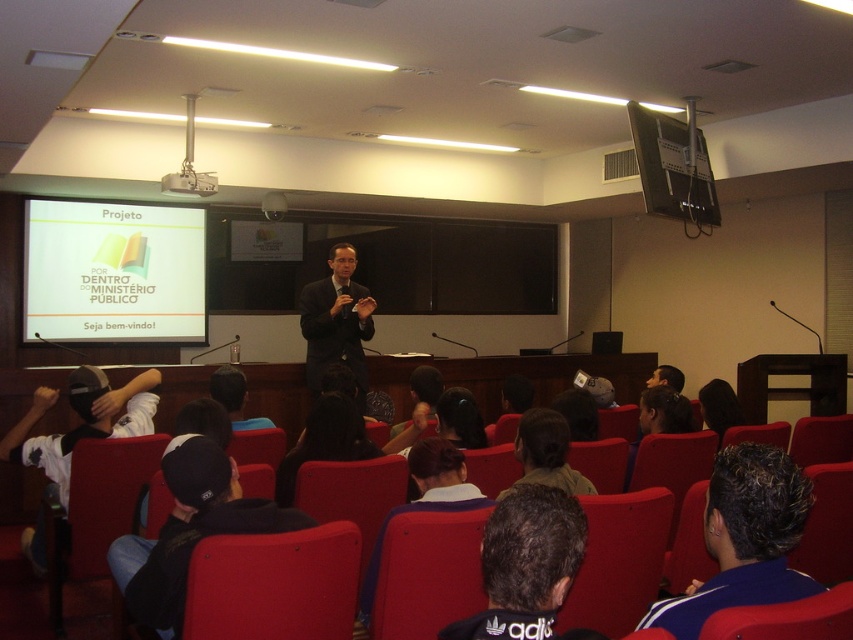
Question: Which point is closer to the camera taking this photo?

Choices:
 (A) (67, 433)
 (B) (190, 177)

Answer: (A)

Question: Which object is closer to the camera taking this photo?

Choices:
 (A) black fabric cap at lower left
 (B) black adidas shirt at center
 (C) dark brown hair at upper center

Answer: (B)

Question: Which point is closer to the camera?

Choices:
 (A) (167, 186)
 (B) (769, 480)

Answer: (B)

Question: Does dark gray cap at lower left appear on the right side of dark hair at center?

Choices:
 (A) no
 (B) yes

Answer: (A)

Question: Can you confirm if matte red chair at lower center is wider than black hair at center?

Choices:
 (A) no
 (B) yes

Answer: (B)

Question: Is dark gray cap at lower left behind dark hair at center?

Choices:
 (A) no
 (B) yes

Answer: (B)